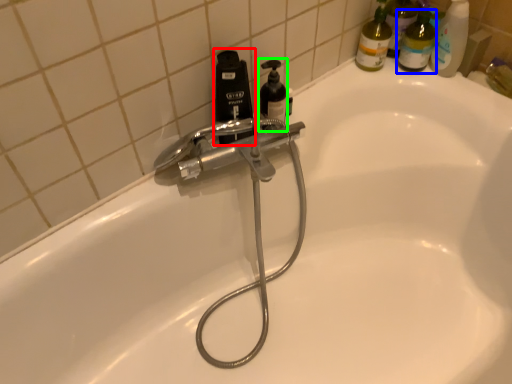
Question: Estimate the real-world distances between objects in this image. Which object is farther from bottle (highlighted by a red box), toiletry (highlighted by a blue box) or soap dispenser (highlighted by a green box)?

Choices:
 (A) toiletry
 (B) soap dispenser

Answer: (A)